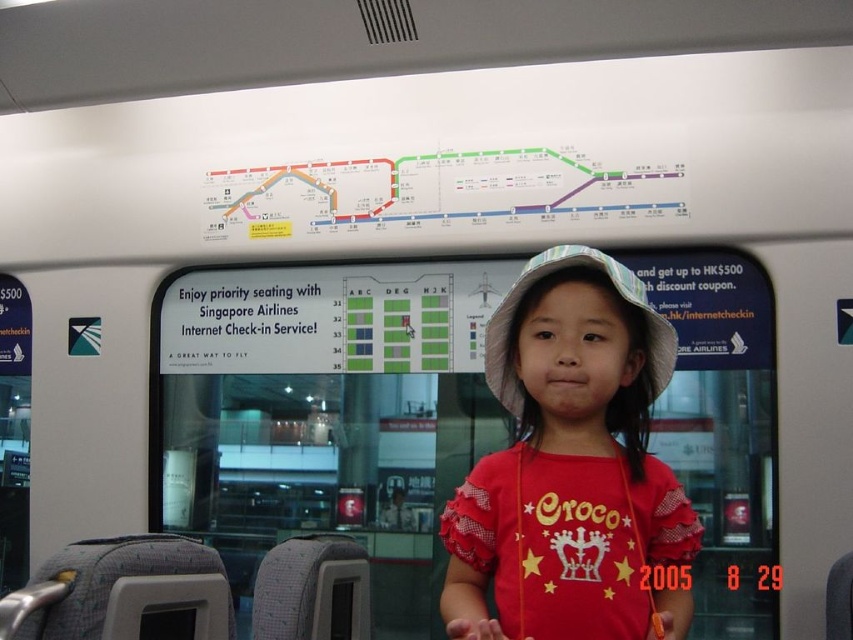
The young girl is wearing a red cotton shirt at center and a light blue fabric hat at center. If the shirt is wider than the hat, which clothing item would you say has a greater horizontal span when viewed from the front?

The red cotton shirt at center has a greater horizontal span than the light blue fabric hat at center because the red cotton shirt at center is wider than the light blue fabric hat at center according to the description.

The young girl is wearing a red cotton shirt at center and a light blue fabric hat at center. Which clothing item is positioned more to the left?

The red cotton shirt at center is positioned more to the left than the light blue fabric hat at center.